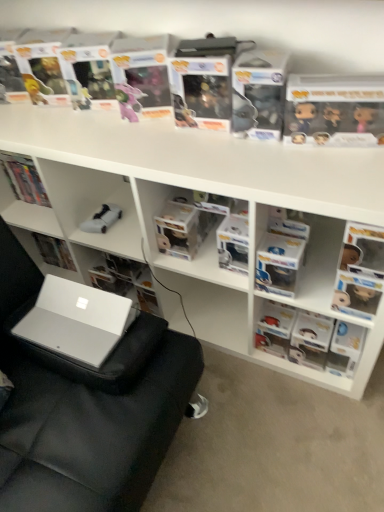
Question: Considering the relative sizes of white matte book at center, arranged as the first book when viewed from the left, and white plastic shelves at upper center in the image provided, is white matte book at center, arranged as the first book when viewed from the left, bigger than white plastic shelves at upper center?

Choices:
 (A) no
 (B) yes

Answer: (A)

Question: From a real-world perspective, is white matte book at center, arranged as the first book when viewed from the left, positioned over white plastic shelves at upper center based on gravity?

Choices:
 (A) no
 (B) yes

Answer: (A)

Question: From the image's perspective, is white matte book at center, arranged as the first book when viewed from the left, above white plastic shelves at upper center?

Choices:
 (A) no
 (B) yes

Answer: (A)

Question: Can you confirm if white matte book at center, arranged as the first book when viewed from the left, is shorter than white plastic shelves at upper center?

Choices:
 (A) yes
 (B) no

Answer: (A)

Question: Can you confirm if white matte book at center, the third book in the right-to-left sequence, is smaller than white plastic shelves at upper center?

Choices:
 (A) yes
 (B) no

Answer: (A)

Question: From the image's perspective, relative to white plastic shelves at upper center, is clear plastic container at center, positioned as the 2th book in right-to-left order, above or below?

Choices:
 (A) below
 (B) above

Answer: (B)

Question: From a real-world perspective, is clear plastic container at center, the second book viewed from the left, above or below white plastic shelves at upper center?

Choices:
 (A) above
 (B) below

Answer: (A)

Question: Which is correct: clear plastic container at center, the second book viewed from the left, is inside white plastic shelves at upper center, or outside of it?

Choices:
 (A) inside
 (B) outside

Answer: (A)

Question: Is point (193, 192) positioned closer to the camera than point (153, 266)?

Choices:
 (A) closer
 (B) farther

Answer: (A)

Question: Does point (175, 123) appear closer or farther from the camera than point (84, 358)?

Choices:
 (A) closer
 (B) farther

Answer: (B)

Question: In terms of width, does clear plastic book at upper center, the 2th paperback book when ordered from right to left, look wider or thinner when compared to silver metallic laptop at lower left?

Choices:
 (A) wide
 (B) thin

Answer: (B)

Question: From the image's perspective, relative to silver metallic laptop at lower left, is clear plastic book at upper center, placed as the first paperback book when sorted from left to right, above or below?

Choices:
 (A) above
 (B) below

Answer: (A)

Question: Is clear plastic book at upper center, placed as the first paperback book when sorted from left to right, to the left or to the right of silver metallic laptop at lower left in the image?

Choices:
 (A) right
 (B) left

Answer: (A)

Question: From their relative heights in the image, would you say clear plastic book at upper center, the 2th paperback book when ordered from right to left, is taller or shorter than white plastic shelves at upper center?

Choices:
 (A) short
 (B) tall

Answer: (A)

Question: Considering the positions of clear plastic book at upper center, the 2th paperback book when ordered from right to left, and white plastic shelves at upper center in the image, is clear plastic book at upper center, the 2th paperback book when ordered from right to left, wider or thinner than white plastic shelves at upper center?

Choices:
 (A) wide
 (B) thin

Answer: (B)